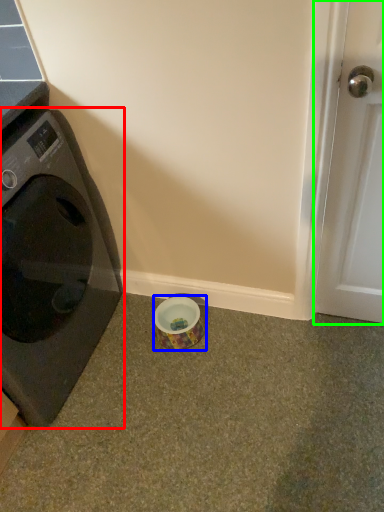
Question: Which is farther away from washing machine (highlighted by a red box)? tape (highlighted by a blue box) or door (highlighted by a green box)?

Choices:
 (A) tape
 (B) door

Answer: (B)